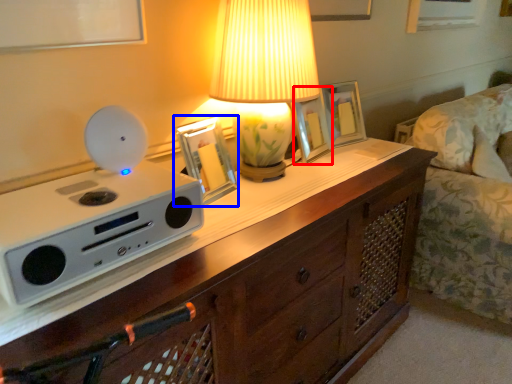
Question: Which of the following is the farthest to the observer, picture frame (highlighted by a red box) or picture frame (highlighted by a blue box)?

Choices:
 (A) picture frame
 (B) picture frame

Answer: (A)